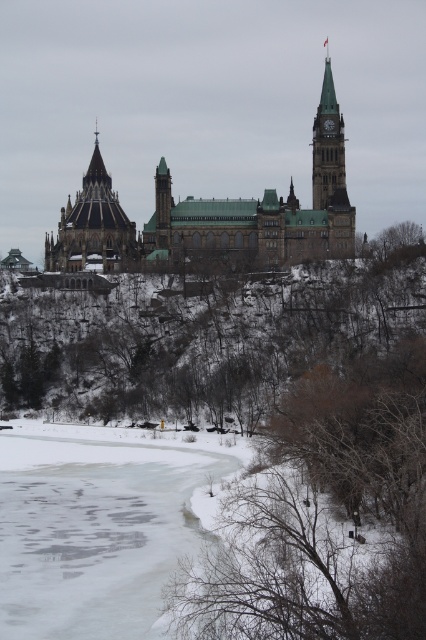
Question: Which point is farther to the camera?

Choices:
 (A) (54, 268)
 (B) (106, 557)
 (C) (331, 148)

Answer: (C)

Question: Can you confirm if dark brown stone tower at upper left is wider than green stone clock tower at upper center?

Choices:
 (A) no
 (B) yes

Answer: (B)

Question: Is dark brown stone tower at upper left behind green stone clock tower at upper center?

Choices:
 (A) no
 (B) yes

Answer: (B)

Question: Among these points, which one is farthest from the camera?

Choices:
 (A) (327, 195)
 (B) (121, 221)

Answer: (B)

Question: Does frozen ice at lower left have a greater width compared to brown stone castle at center?

Choices:
 (A) yes
 (B) no

Answer: (B)

Question: Which point is farther from the camera taking this photo?

Choices:
 (A) (101, 221)
 (B) (267, 216)
 (C) (324, 205)
 (D) (135, 467)

Answer: (C)